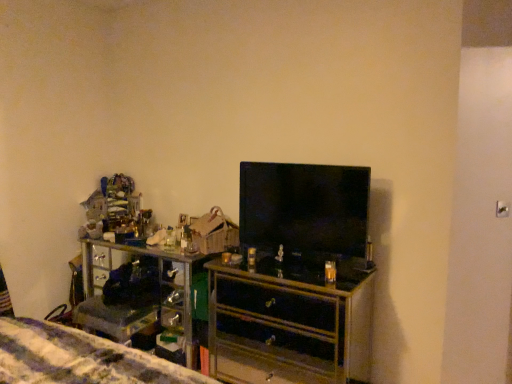
This screenshot has width=512, height=384. Describe the element at coordinates (305, 212) in the screenshot. I see `black glossy tv at center` at that location.

In order to click on black glossy tv at center in this screenshot , I will do `click(305, 212)`.

What is the approximate height of black glossy chest of drawers at center?

It is 79.65 centimeters.

You are a GUI agent. You are given a task and a screenshot of the screen. Output one action in this format:
    pyautogui.click(x=<x>, y=<y>)
    Task: Click on the black glossy chest of drawers at center
    The image size is (512, 384).
    Given the screenshot: What is the action you would take?
    pyautogui.click(x=292, y=320)

What do you see at coordinates (292, 320) in the screenshot?
I see `black glossy chest of drawers at center` at bounding box center [292, 320].

Locate an element on the screen. The image size is (512, 384). black glossy tv at center is located at coordinates (x=305, y=212).

Is black glossy chest of drawers at center to the left or to the right of black glossy tv at center in the image?

black glossy chest of drawers at center is to the left of black glossy tv at center.

Which object is more forward, black glossy chest of drawers at center or black glossy tv at center?

black glossy chest of drawers at center is closer to the camera.

Is point (280, 346) closer to camera compared to point (252, 222)?

No, (280, 346) is further to viewer.

From the image's perspective, does black glossy chest of drawers at center appear higher than black glossy tv at center?

No.

From a real-world perspective, relative to black glossy tv at center, is black glossy chest of drawers at center vertically above or below?

black glossy chest of drawers at center is below black glossy tv at center.

Which object is wider, black glossy chest of drawers at center or black glossy tv at center?

Wider between the two is black glossy chest of drawers at center.

Is black glossy chest of drawers at center taller or shorter than black glossy tv at center?

Considering their sizes, black glossy chest of drawers at center has more height than black glossy tv at center.

Does black glossy chest of drawers at center have a larger size compared to black glossy tv at center?

Yes.

Is black glossy chest of drawers at center outside of black glossy tv at center?

Yes.

Are black glossy chest of drawers at center and black glossy tv at center far apart?

black glossy chest of drawers at center is near black glossy tv at center, not far away.

Consider the image. Does black glossy chest of drawers at center turn towards black glossy tv at center?

No, black glossy chest of drawers at center is not aimed at black glossy tv at center.

Can you tell me how much black glossy chest of drawers at center and black glossy tv at center differ in facing direction?

The angle between the facing direction of black glossy chest of drawers at center and the facing direction of black glossy tv at center is 1.82 degrees.

At what (x,y) coordinates should I click in order to perform the action: click on tv show to the right of black glossy chest of drawers at center. Please return your answer as a coordinate pair (x, y). Looking at the image, I should click on (305, 212).

Between black glossy tv at center and black glossy chest of drawers at center, which one appears on the right side from the viewer's perspective?

Positioned to the right is black glossy tv at center.

Is black glossy tv at center further to camera compared to black glossy chest of drawers at center?

That is True.

Which is farther, (365,202) or (262,309)?

The point (262,309) is farther.

From the image's perspective, is black glossy tv at center above black glossy chest of drawers at center?

Correct, black glossy tv at center appears higher than black glossy chest of drawers at center in the image.

From a real-world perspective, is black glossy tv at center located beneath black glossy chest of drawers at center?

Actually, black glossy tv at center is physically above black glossy chest of drawers at center in the real world.

Considering the sizes of objects black glossy tv at center and black glossy chest of drawers at center in the image provided, who is wider, black glossy tv at center or black glossy chest of drawers at center?

With larger width is black glossy chest of drawers at center.

Between black glossy tv at center and black glossy chest of drawers at center, which one has less height?

black glossy tv at center.

Who is bigger, black glossy tv at center or black glossy chest of drawers at center?

black glossy chest of drawers at center is bigger.

Is black glossy tv at center inside the boundaries of black glossy chest of drawers at center, or outside?

black glossy tv at center is outside black glossy chest of drawers at center.

Is the surface of black glossy tv at center in direct contact with black glossy chest of drawers at center?

black glossy tv at center is not next to black glossy chest of drawers at center, and they're not touching.

Is black glossy tv at center aimed at black glossy chest of drawers at center?

No, black glossy tv at center does not turn towards black glossy chest of drawers at center.

Identify the location of chest of drawers on the left of black glossy tv at center. This screenshot has height=384, width=512. (292, 320).

In the image, there is a black glossy tv at center. Where is `the chest of drawers below it (from a real-world perspective)`? The width and height of the screenshot is (512, 384). the chest of drawers below it (from a real-world perspective) is located at coordinates (292, 320).

Image resolution: width=512 pixels, height=384 pixels. I want to click on chest of drawers on the left of black glossy tv at center, so click(x=292, y=320).